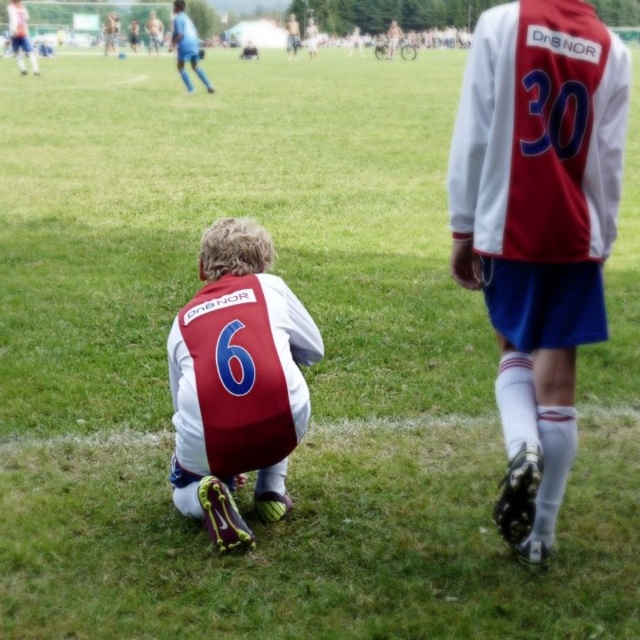
Can you confirm if matte red vest at lower left is positioned above matte blue shorts at upper left?

Actually, matte red vest at lower left is below matte blue shorts at upper left.

Is matte red vest at lower left to the left of matte blue shorts at upper left from the viewer's perspective?

Answer: Incorrect, matte red vest at lower left is not on the left side of matte blue shorts at upper left.

Is point (204, 456) positioned before point (19, 51)?

Yes.

Locate an element on the screen. The width and height of the screenshot is (640, 640). matte red vest at lower left is located at coordinates (237, 381).

Who is more distant from viewer, (205, 90) or (10, 22)?

The point (10, 22) is behind.

Find the location of a particular element. The height and width of the screenshot is (640, 640). blue fabric shorts at upper left is located at coordinates (186, 45).

The width and height of the screenshot is (640, 640). In order to click on blue fabric shorts at upper left in this screenshot , I will do `click(186, 45)`.

Is matte white jersey at center wider than matte blue shorts at upper left?

No.

From the picture: Who is positioned more to the right, matte white jersey at center or matte blue shorts at upper left?

Positioned to the right is matte white jersey at center.

Which is in front, point (524, 362) or point (10, 17)?

Point (524, 362) is more forward.

The width and height of the screenshot is (640, 640). I want to click on matte white jersey at center, so click(538, 227).